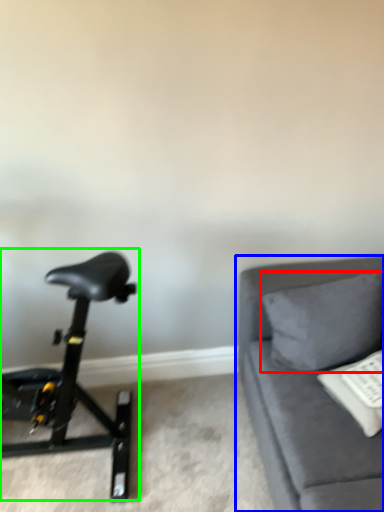
Question: Considering the real-world distances, which object is farthest from pillow (highlighted by a red box)? studio couch (highlighted by a blue box) or stationary bicycle (highlighted by a green box)?

Choices:
 (A) studio couch
 (B) stationary bicycle

Answer: (B)